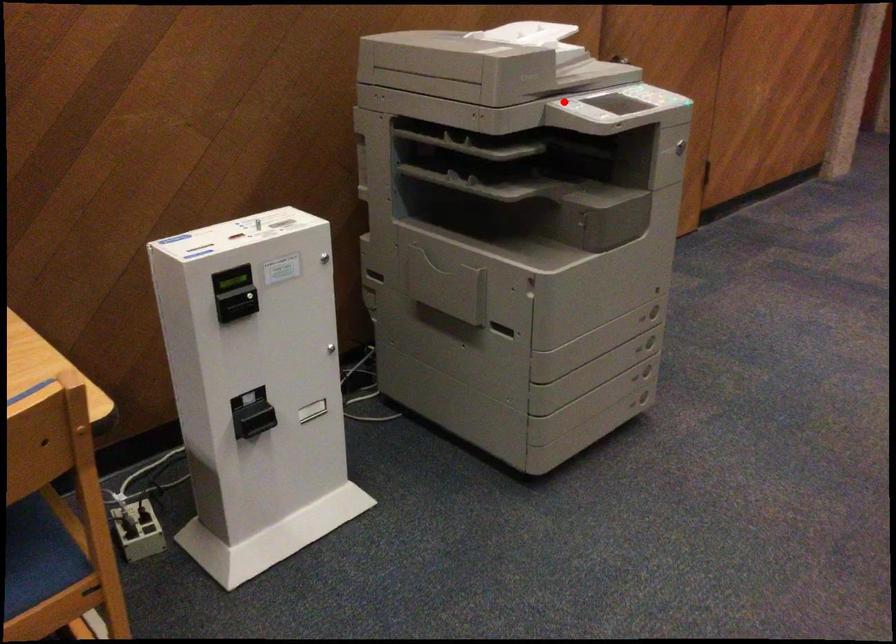
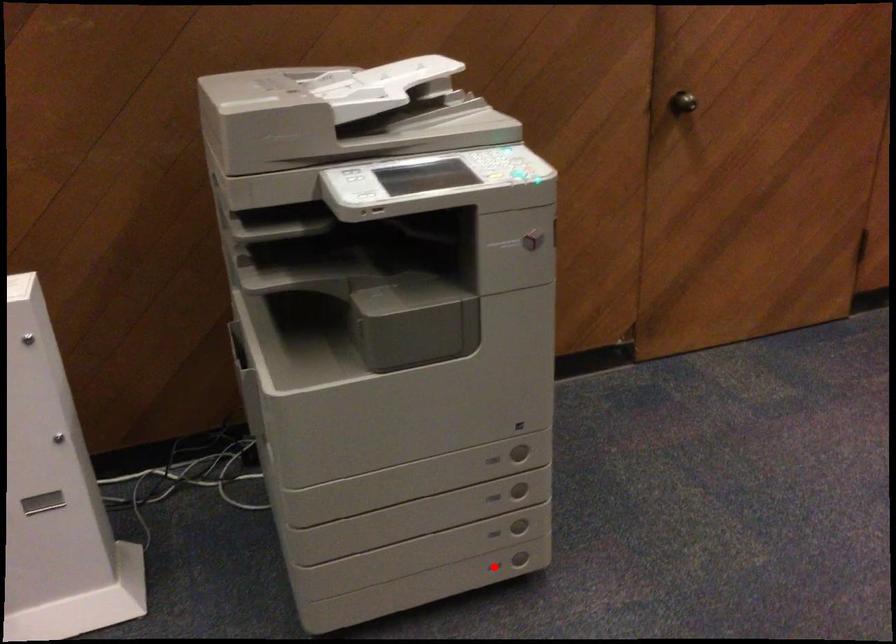
I am providing you with two images of the same scene from different viewpoints. A red point is marked on the first image and another point is marked on the second image. Does the point marked in image1 correspond to the same location as the one in image2?

No